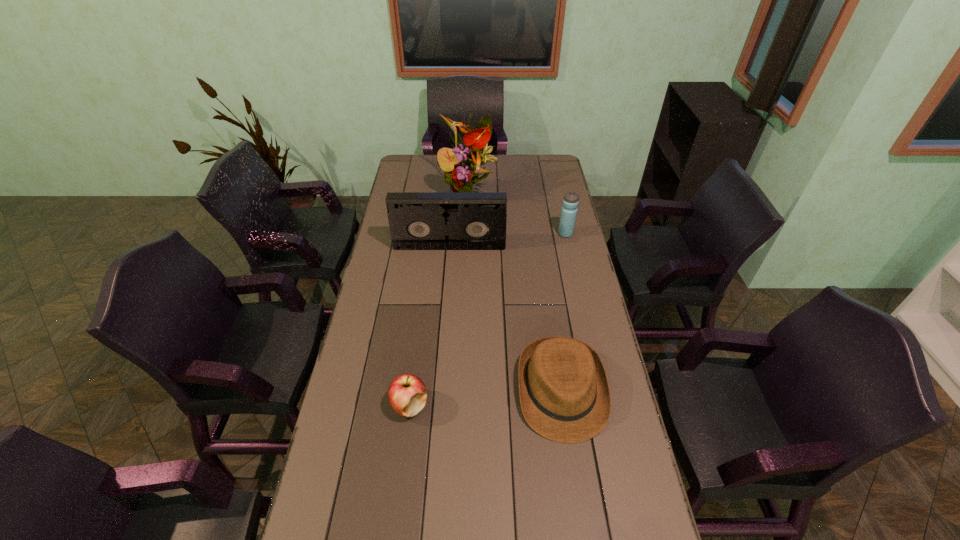
At what (x,y) coordinates should I click in order to perform the action: click on empty space that is in between the apple and the fedora. Please return your answer as a coordinate pair (x, y). Looking at the image, I should click on (486, 399).

Find the location of a particular element. Image resolution: width=960 pixels, height=540 pixels. vacant space in between the tallest object and the third tallest object is located at coordinates (517, 214).

This screenshot has height=540, width=960. In order to click on vacant space that is in between the fedora and the farthest object in this screenshot , I will do `click(516, 293)`.

This screenshot has width=960, height=540. I want to click on free space between the fedora and the water bottle, so click(564, 313).

At what (x,y) coordinates should I click in order to perform the action: click on empty location between the fedora and the videotape. Please return your answer as a coordinate pair (x, y). The height and width of the screenshot is (540, 960). Looking at the image, I should click on (506, 319).

Identify the location of free spot between the apple and the farthest object. (439, 299).

Locate an element on the screen. Image resolution: width=960 pixels, height=540 pixels. free spot between the third farthest object and the fedora is located at coordinates (506, 319).

Identify the location of object that is the fourth nearest to the apple. The width and height of the screenshot is (960, 540). (462, 165).

Where is `object that is the second closest to the bouquet`? object that is the second closest to the bouquet is located at coordinates (570, 202).